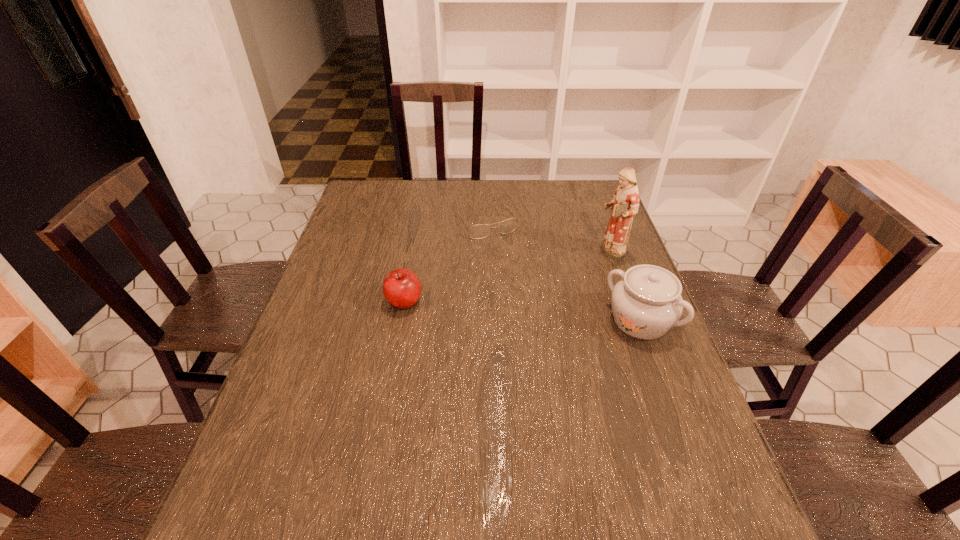
In the image, there is a desktop. Identify the location of vacant area at the left edge. This screenshot has height=540, width=960. [x=379, y=234].

In the image, there is a desktop. At what (x,y) coordinates should I click in order to perform the action: click on vacant space at the far left corner. Please return your answer as a coordinate pair (x, y). This screenshot has width=960, height=540. Looking at the image, I should click on (374, 181).

The image size is (960, 540). I want to click on vacant position at the far right corner of the desktop, so click(601, 213).

Find the location of a particular element. This screenshot has width=960, height=540. free space between the apple and the shortest object is located at coordinates (445, 262).

Where is `free space between the farthest object and the figurine`? This screenshot has height=540, width=960. free space between the farthest object and the figurine is located at coordinates (548, 238).

You are a GUI agent. You are given a task and a screenshot of the screen. Output one action in this format:
    pyautogui.click(x=<x>, y=<y>)
    Task: Click on the blank region between the farthest object and the chinaware
    
    Given the screenshot: What is the action you would take?
    pyautogui.click(x=564, y=272)

The image size is (960, 540). In order to click on empty space that is in between the third tallest object and the spectacles in this screenshot , I will do `click(445, 262)`.

Find the location of a particular element. The height and width of the screenshot is (540, 960). free spot between the figurine and the second shortest object is located at coordinates pyautogui.click(x=507, y=277).

The image size is (960, 540). Identify the location of vacant region between the figurine and the leftmost object. (507, 277).

Find the location of a particular element. The height and width of the screenshot is (540, 960). blank region between the spectacles and the figurine is located at coordinates (548, 238).